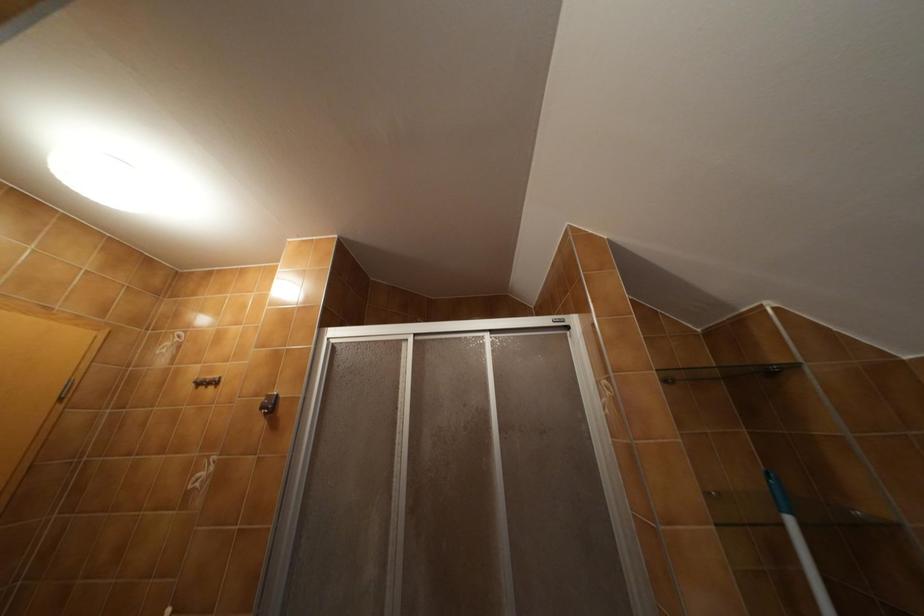
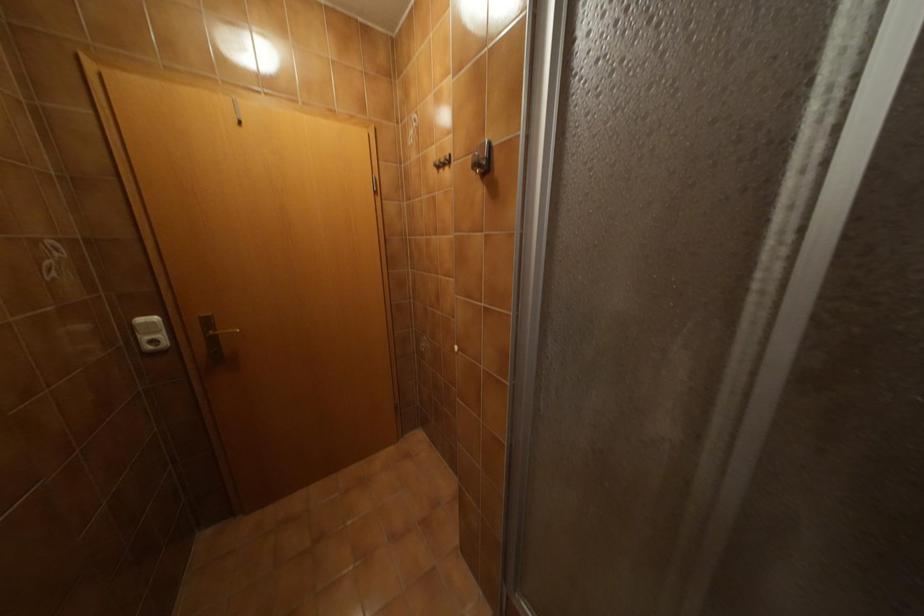
First-person continuous shooting, in which direction is the camera rotating?

The camera's rotation is toward left-down.